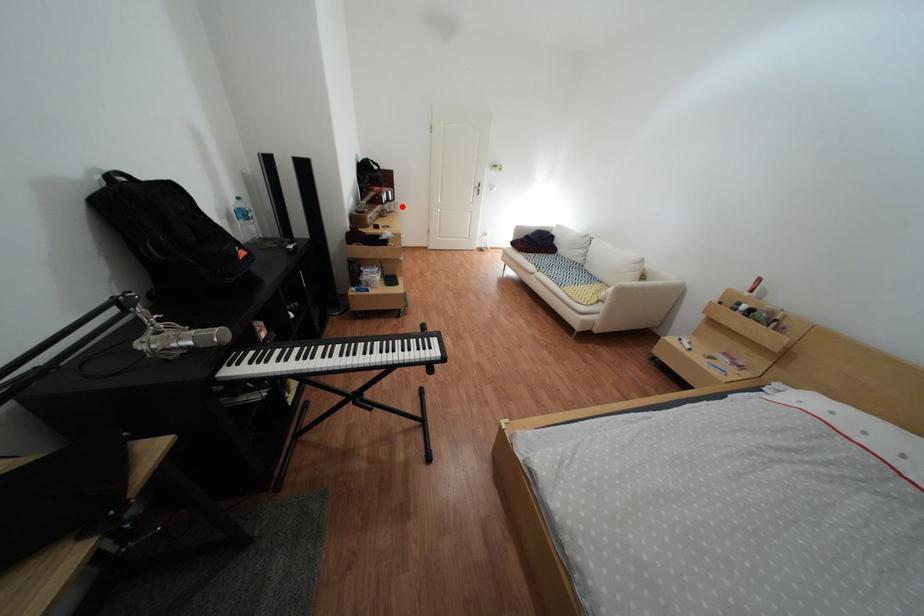
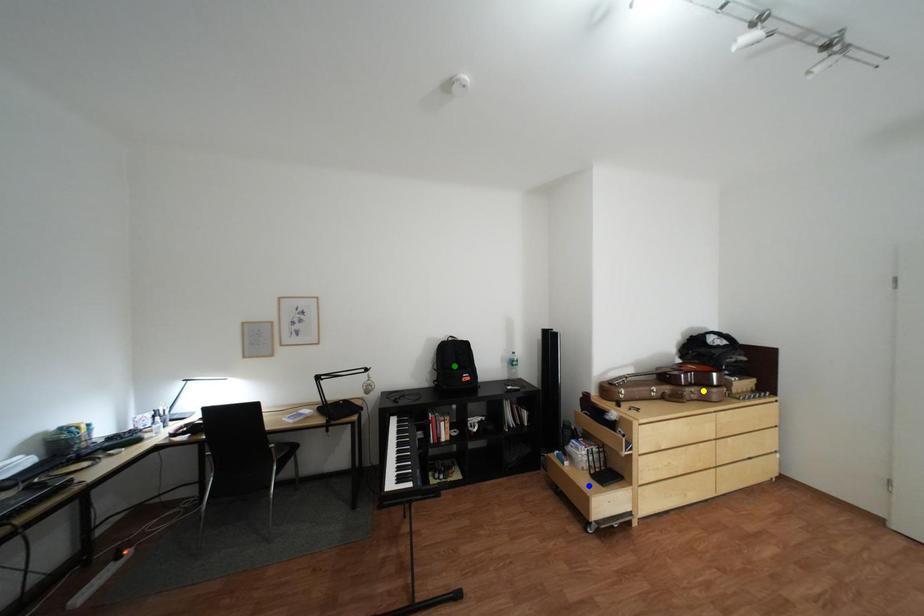
Question: I am providing you with two images of the same scene from different viewpoints. A red point is marked on the first image. You are given multiple points on the second image. Which point in image 2 represents the same 3d spot as the red point in image 1?

Choices:
 (A) blue point
 (B) green point
 (C) yellow point

Answer: (C)